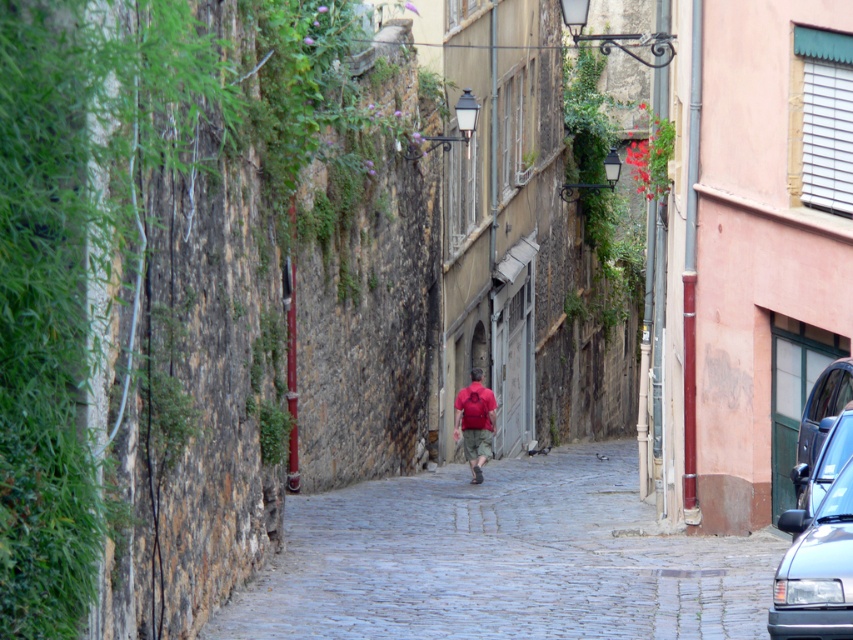
In the scene shown: Does cobblestone path at center have a greater height compared to metallic silver car at right?

In fact, cobblestone path at center may be shorter than metallic silver car at right.

Is point (554, 637) positioned before point (814, 435)?

Yes, point (554, 637) is closer to viewer.

Find the location of a particular element. cobblestone path at center is located at coordinates (502, 561).

This screenshot has width=853, height=640. Find the location of `cobblestone path at center`. cobblestone path at center is located at coordinates (502, 561).

Who is lower down, black glossy car at lower right or metallic silver car at right?

black glossy car at lower right

Is point (796, 586) more distant than point (825, 406)?

No, it is in front of (825, 406).

Is point (833, 624) behind point (798, 458)?

No, it is in front of (798, 458).

Locate an element on the screen. black glossy car at lower right is located at coordinates (816, 568).

Which is behind, point (799, 449) or point (486, 413)?

Point (486, 413)

What do you see at coordinates (820, 417) in the screenshot? I see `metallic silver car at right` at bounding box center [820, 417].

This screenshot has height=640, width=853. What are the coordinates of `metallic silver car at right` in the screenshot? It's located at (820, 417).